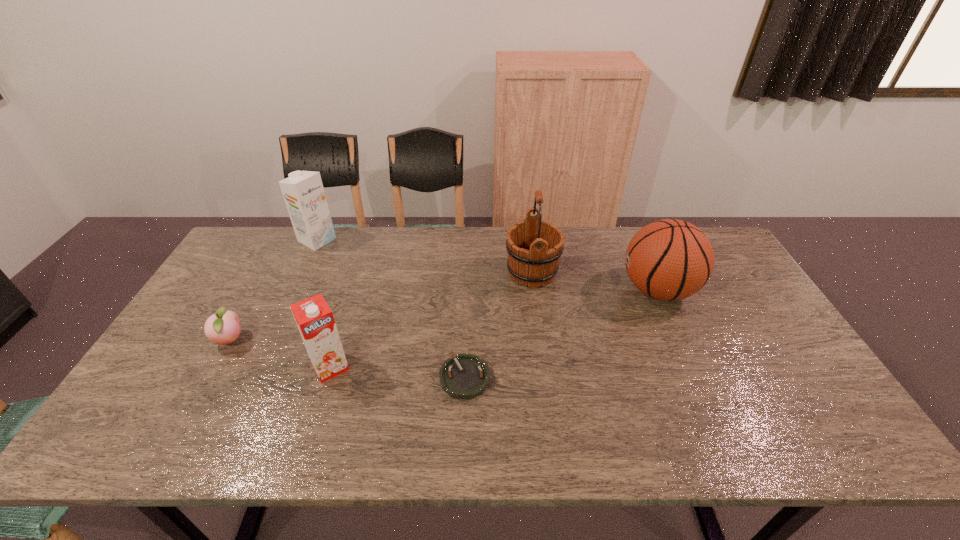
Locate an element on the screen. object at the left edge is located at coordinates (223, 327).

The width and height of the screenshot is (960, 540). I want to click on free space at the far edge, so click(605, 247).

In the image, there is a desktop. At what (x,y) coordinates should I click in order to perform the action: click on vacant space at the near edge. Please return your answer as a coordinate pair (x, y). This screenshot has width=960, height=540. Looking at the image, I should click on (626, 443).

You are a GUI agent. You are given a task and a screenshot of the screen. Output one action in this format:
    pyautogui.click(x=<x>, y=<y>)
    Task: Click on the blank space at the left edge of the desktop
    
    Given the screenshot: What is the action you would take?
    pyautogui.click(x=193, y=334)

The height and width of the screenshot is (540, 960). I want to click on vacant space that's between the farther carton and the shortest object, so click(391, 309).

Where is `vacant area that lies between the peach and the third object from right to left`? vacant area that lies between the peach and the third object from right to left is located at coordinates (348, 359).

Identify the location of free space between the peach and the wine bucket. The height and width of the screenshot is (540, 960). (381, 306).

Locate an element on the screen. This screenshot has width=960, height=540. free space between the wine bucket and the fifth tallest object is located at coordinates (381, 306).

At what (x,y) coordinates should I click in order to perform the action: click on free area in between the basketball and the right carton. Please return your answer as a coordinate pair (x, y). Looking at the image, I should click on (494, 328).

The width and height of the screenshot is (960, 540). Identify the location of free point between the ashtray and the peach. (348, 359).